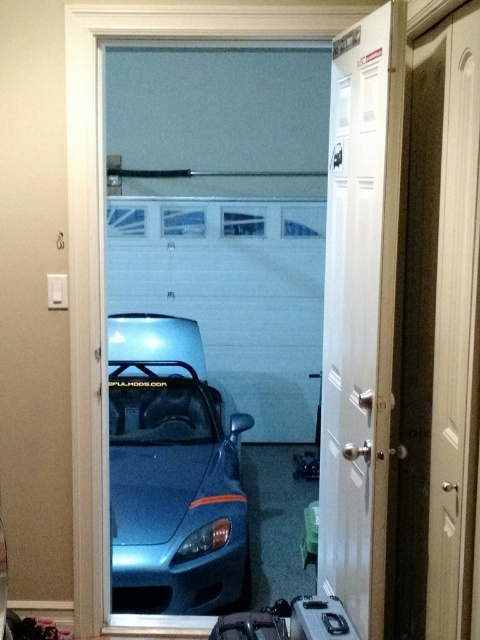
Question: Which of the following is the closest to the observer?

Choices:
 (A) (153, 358)
 (B) (252, 620)

Answer: (B)

Question: Is white glossy door at center thinner than matte black suitcase at lower center?

Choices:
 (A) no
 (B) yes

Answer: (B)

Question: Which point appears farthest from the camera in this image?

Choices:
 (A) 133,480
 (B) 287,609
 (C) 351,481

Answer: (A)

Question: Which is farther from the white glossy door at center?

Choices:
 (A) satin blue car at center
 (B) matte black suitcase at lower center

Answer: (A)

Question: Does satin blue car at center have a greater width compared to matte black suitcase at lower center?

Choices:
 (A) no
 (B) yes

Answer: (B)

Question: Does white glossy door at center appear on the right side of matte black suitcase at lower center?

Choices:
 (A) yes
 (B) no

Answer: (A)